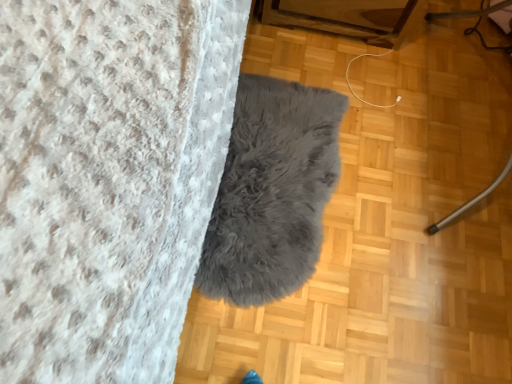
Question: Considering the relative positions of gray fluffy rug at center and metallic silver vacuum cleaner at right in the image provided, is gray fluffy rug at center to the right of metallic silver vacuum cleaner at right from the viewer's perspective?

Choices:
 (A) yes
 (B) no

Answer: (B)

Question: Does gray fluffy rug at center have a greater height compared to metallic silver vacuum cleaner at right?

Choices:
 (A) yes
 (B) no

Answer: (B)

Question: Does gray fluffy rug at center come behind metallic silver vacuum cleaner at right?

Choices:
 (A) yes
 (B) no

Answer: (A)

Question: Does gray fluffy rug at center have a smaller size compared to metallic silver vacuum cleaner at right?

Choices:
 (A) no
 (B) yes

Answer: (B)

Question: Is gray fluffy rug at center thinner than metallic silver vacuum cleaner at right?

Choices:
 (A) no
 (B) yes

Answer: (A)

Question: Does gray fluffy rug at center have a lesser height compared to metallic silver vacuum cleaner at right?

Choices:
 (A) yes
 (B) no

Answer: (A)

Question: From the image's perspective, is metallic silver vacuum cleaner at right under gray fluffy rug at center?

Choices:
 (A) no
 (B) yes

Answer: (A)

Question: Is the surface of metallic silver vacuum cleaner at right in direct contact with gray fluffy rug at center?

Choices:
 (A) no
 (B) yes

Answer: (A)

Question: Is metallic silver vacuum cleaner at right in front of gray fluffy rug at center?

Choices:
 (A) yes
 (B) no

Answer: (A)

Question: Is metallic silver vacuum cleaner at right to the left of gray fluffy rug at center from the viewer's perspective?

Choices:
 (A) yes
 (B) no

Answer: (B)

Question: Is metallic silver vacuum cleaner at right taller than gray fluffy rug at center?

Choices:
 (A) no
 (B) yes

Answer: (B)

Question: Is metallic silver vacuum cleaner at right outside of gray fluffy rug at center?

Choices:
 (A) no
 (B) yes

Answer: (B)

Question: Considering the positions of gray fluffy rug at center and metallic silver vacuum cleaner at right in the image, is gray fluffy rug at center taller or shorter than metallic silver vacuum cleaner at right?

Choices:
 (A) tall
 (B) short

Answer: (B)